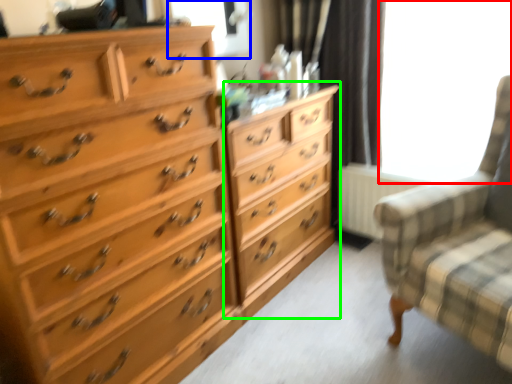
Question: Which object is positioned farthest from window screen (highlighted by a red box)? Select from window screen (highlighted by a blue box) and dresser (highlighted by a green box).

Choices:
 (A) window screen
 (B) dresser

Answer: (A)